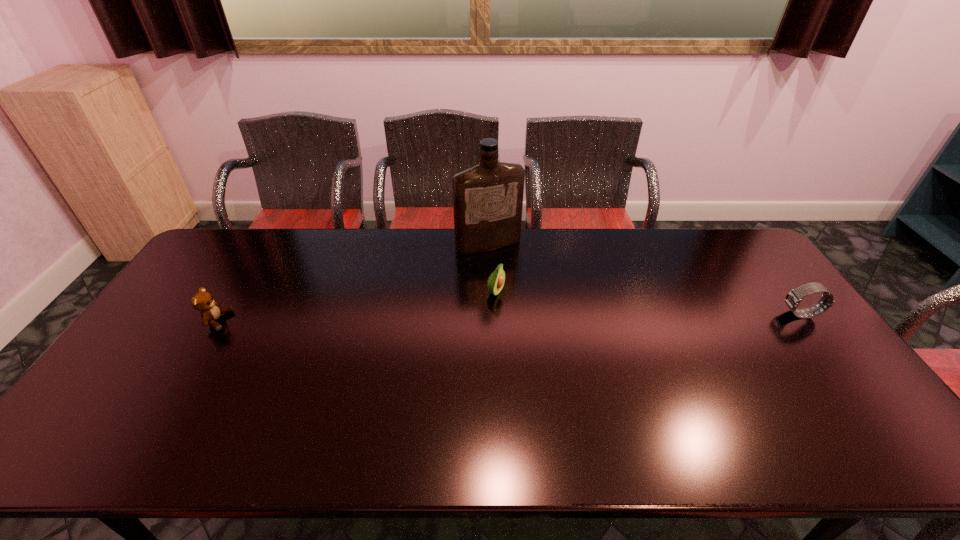
Find the location of a particular element. This screenshot has height=540, width=960. teddy bear is located at coordinates (202, 301).

Image resolution: width=960 pixels, height=540 pixels. I want to click on the rightmost object, so click(x=794, y=297).

In order to click on the tallest object in this screenshot , I will do `click(488, 198)`.

Where is `liquor`? This screenshot has width=960, height=540. liquor is located at coordinates (488, 198).

Identify the location of the second farthest object. (496, 281).

I want to click on vacant region located on the front-facing side of the leftmost object, so click(297, 321).

Find the location of a particular element. vacant position located on the face of the rightmost object is located at coordinates (695, 314).

I want to click on vacant space situated on the face of the rightmost object, so click(758, 314).

Locate an element on the screen. Image resolution: width=960 pixels, height=540 pixels. free space located on the face of the rightmost object is located at coordinates (655, 314).

Image resolution: width=960 pixels, height=540 pixels. In order to click on free space located on the label side of the farthest object in this screenshot , I will do `click(518, 286)`.